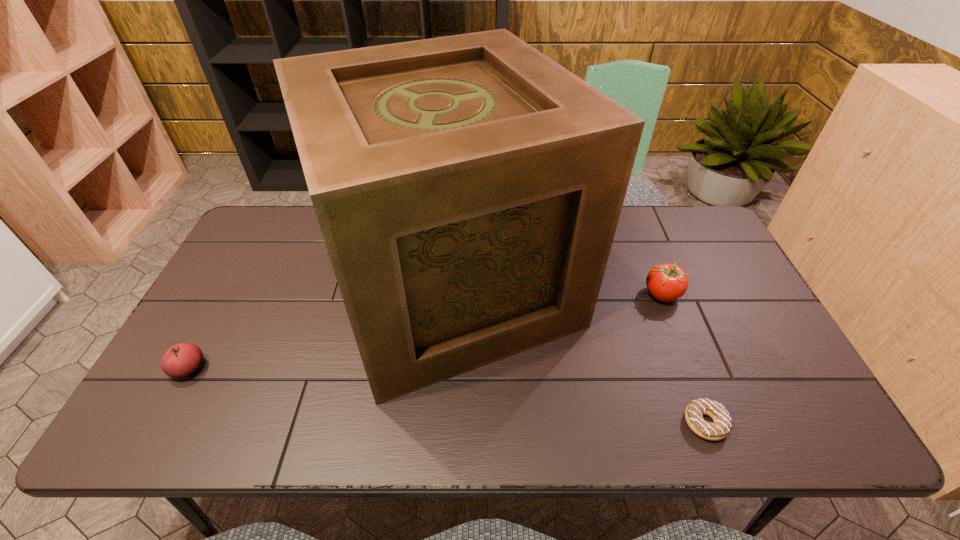
At what (x,y) coordinates should I click in order to perform the action: click on vacant space located on the left of the doughnut. Please return your answer as a coordinate pair (x, y). The width and height of the screenshot is (960, 540). Looking at the image, I should click on (564, 423).

What are the coordinates of `object present at the far edge` in the screenshot? It's located at (468, 188).

Locate an element on the screen. This screenshot has width=960, height=540. object at the near edge is located at coordinates (694, 412).

Find the location of a particular element. object that is at the left edge is located at coordinates (180, 360).

This screenshot has height=540, width=960. What are the coordinates of `vacant space at the near edge of the desktop` in the screenshot? It's located at (665, 414).

In the image, there is a desktop. Identify the location of blank space at the left edge. (223, 322).

In the image, there is a desktop. Identify the location of free region at the right edge. (745, 353).

This screenshot has height=540, width=960. In order to click on free space at the far right corner of the desktop in this screenshot , I will do [x=675, y=240].

The height and width of the screenshot is (540, 960). Find the location of `blank space at the near right corner of the desktop`. blank space at the near right corner of the desktop is located at coordinates (820, 434).

In order to click on free space between the third shortest object and the shortest object in this screenshot , I will do `click(684, 359)`.